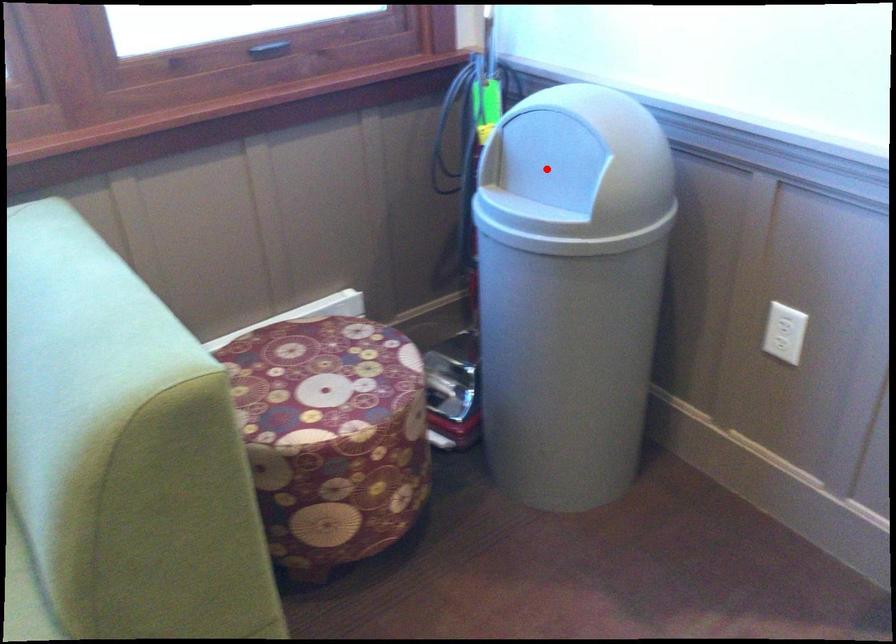
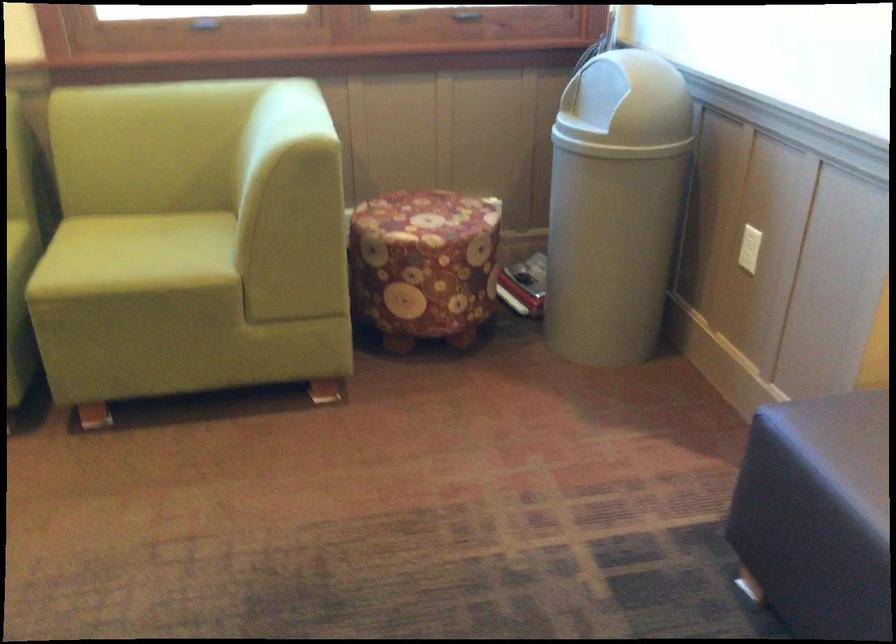
Question: A red point is marked in image1. In image2, is the corresponding 3D point closer to the camera or farther? Reply with the corresponding letter.

Choices:
 (A) The corresponding 3D point is closer.
 (B) The corresponding 3D point is farther.

Answer: (B)